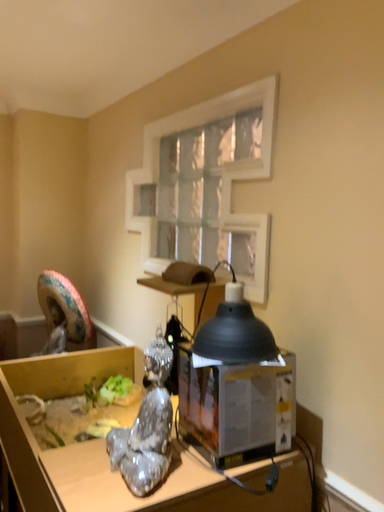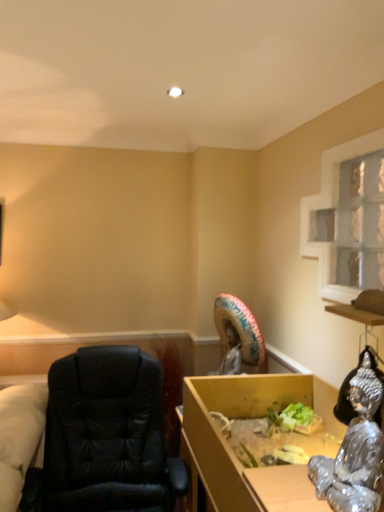
Question: Which way did the camera rotate in the video?

Choices:
 (A) rotated left
 (B) rotated right

Answer: (A)